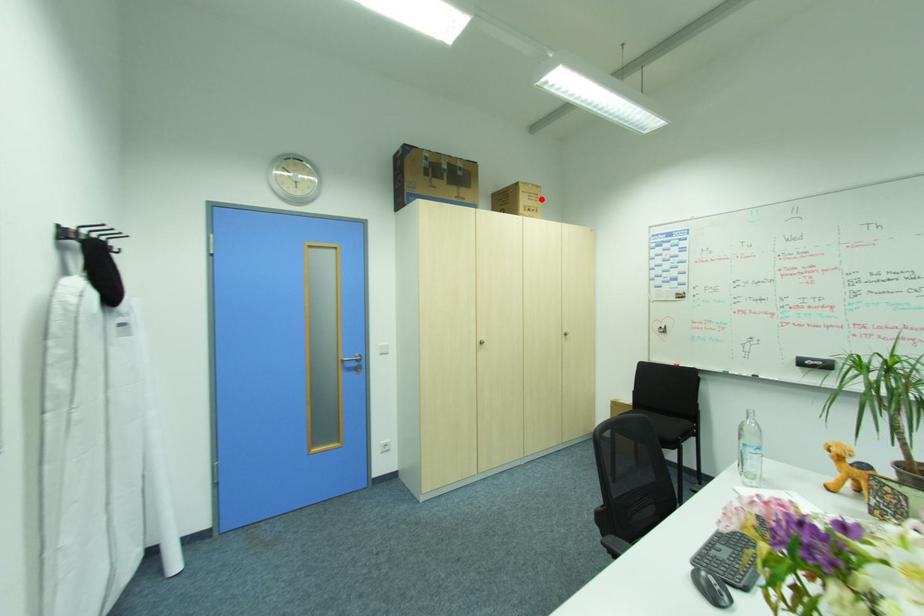
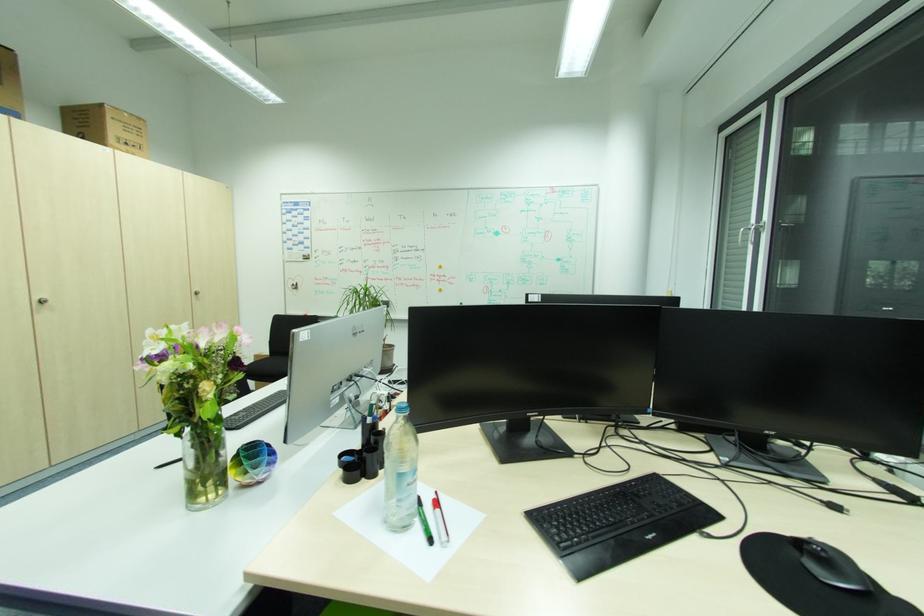
Question: I am providing you with two images of the same scene from different viewpoints. A red point is marked on the first image. At the location where the point appears in image 1, is it still visible in image 2?

Choices:
 (A) Yes
 (B) No

Answer: (A)